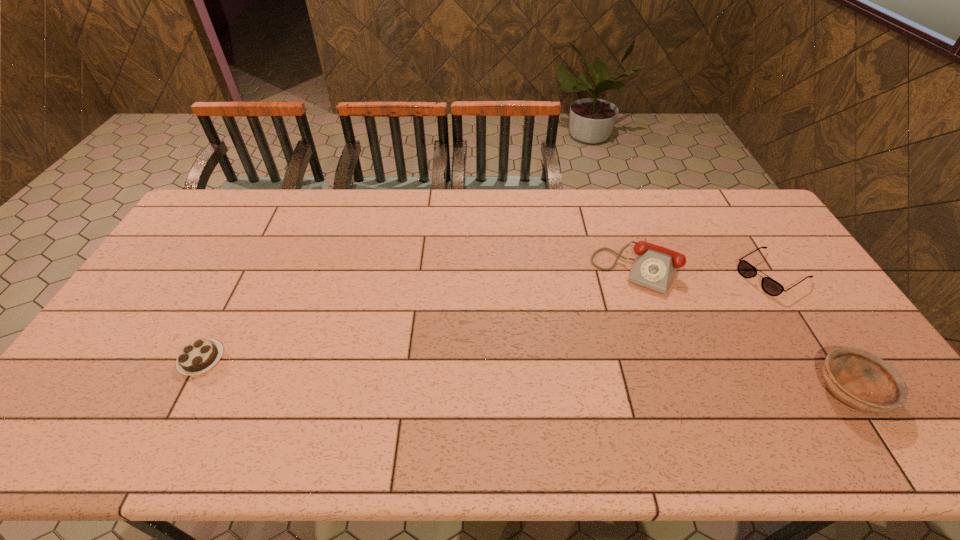
Where is `chocolate cake`? chocolate cake is located at coordinates (198, 356).

Image resolution: width=960 pixels, height=540 pixels. Find the location of `the leftmost object`. the leftmost object is located at coordinates (198, 356).

Locate an element on the screen. This screenshot has height=540, width=960. bowl is located at coordinates (860, 379).

I want to click on telephone, so click(x=654, y=267).

You are a GUI agent. You are given a task and a screenshot of the screen. Output one action in this format:
    pyautogui.click(x=<x>, y=<y>)
    Task: Click on the tallest object
    This screenshot has width=960, height=540.
    Given the screenshot: What is the action you would take?
    coord(654,267)

Identify the location of the third tallest object. point(745,269).

I want to click on free space located on the right of the shortest object, so click(x=341, y=359).

You are a GUI agent. You are given a task and a screenshot of the screen. Output one action in this format:
    pyautogui.click(x=<x>, y=<y>)
    Task: Click on the free space located on the back of the second tallest object
    
    Given the screenshot: What is the action you would take?
    pyautogui.click(x=799, y=311)

What are the coordinates of `vacant space located 0.370m on the dial of the tallest object` in the screenshot? It's located at (579, 390).

This screenshot has height=540, width=960. Find the location of `free spot located 0.300m on the dial of the tallest object`. free spot located 0.300m on the dial of the tallest object is located at coordinates (588, 368).